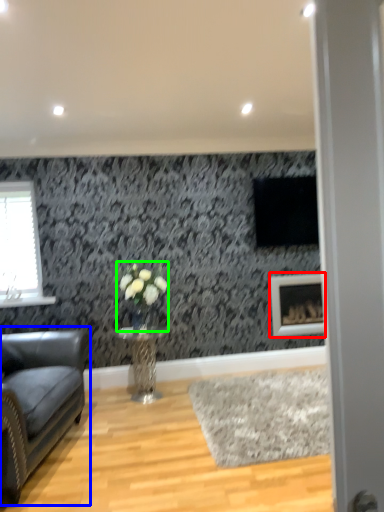
Question: Estimate the real-world distances between objects in this image. Which object is closer to picture frame (highlighted by a red box), studio couch (highlighted by a blue box) or floral arrangement (highlighted by a green box)?

Choices:
 (A) studio couch
 (B) floral arrangement

Answer: (B)